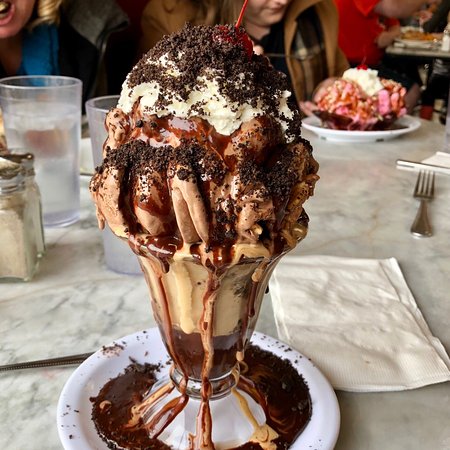
Identify the location of pepper shaker. The height and width of the screenshot is (450, 450). pos(16,220).